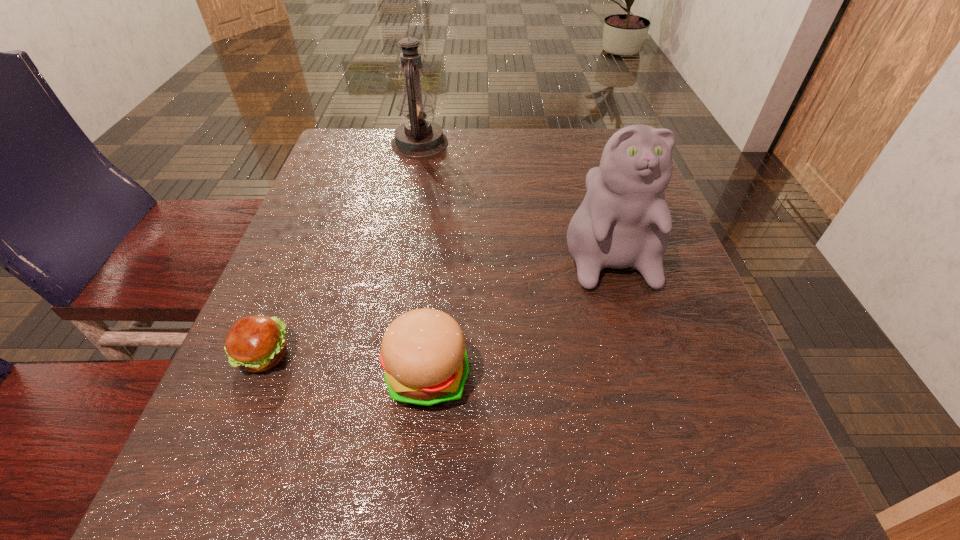
The height and width of the screenshot is (540, 960). What are the coordinates of `vacant space located 0.170m on the right of the leftmost object` in the screenshot? It's located at [x=400, y=355].

Where is `object located at the far edge`? Image resolution: width=960 pixels, height=540 pixels. object located at the far edge is located at coordinates (417, 138).

Where is `oil lamp located in the left edge section of the desktop`? The image size is (960, 540). oil lamp located in the left edge section of the desktop is located at coordinates (417, 138).

Identify the location of hamburger at the left edge. (255, 343).

The height and width of the screenshot is (540, 960). What are the coordinates of `object that is at the right edge` in the screenshot? It's located at (624, 221).

Locate an element on the screen. The height and width of the screenshot is (540, 960). object at the far left corner is located at coordinates (417, 138).

The image size is (960, 540). Identify the location of free space at the far edge of the desktop. (443, 156).

Locate an element on the screen. The image size is (960, 540). free space at the near edge is located at coordinates (457, 484).

In order to click on blank area at the left edge in this screenshot , I will do `click(290, 251)`.

Identify the location of vacant space at the right edge of the desktop. Image resolution: width=960 pixels, height=540 pixels. (587, 193).